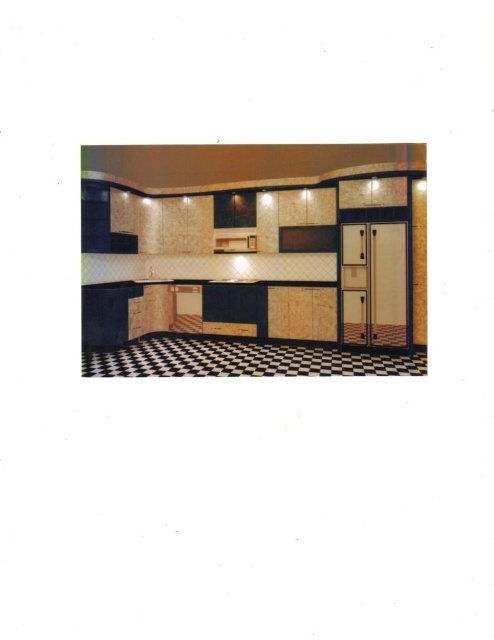
You are a kitchen designer planning to install a new appliance. You need to place a new dishwasher that requires a space between the white glossy refrigerator at right and the matte wood oven at center. Is there enough vertical space between them for the dishwasher?

The white glossy refrigerator at right is located below the matte wood oven at center, meaning there is vertical space between them. However, since dishwashers typically require horizontal space rather than vertical, the vertical gap may not be suitable. Check the horizontal space instead.

You are standing in the kitchen and want to move from the sink area to the microwave. The sink area is near point (233, 228) and the microwave is near point (370, 240). Which point should you head towards first to reach the microwave?

You should head towards point (370, 240) first because it is in front of point (233, 228), meaning it is closer to your current position near the sink area.

You are standing in the kitchen and want to reach the sink on the left side. You have a glass of water in your hand. If you walk straight from the white glossy refrigerator at right towards the matte wood oven at center, will you pass by the sink on the left side?

The white glossy refrigerator at right is to the right of the matte wood oven at center. Since the sink is on the left side of the image, walking straight from the refrigerator towards the oven would not pass by the sink on the left side.